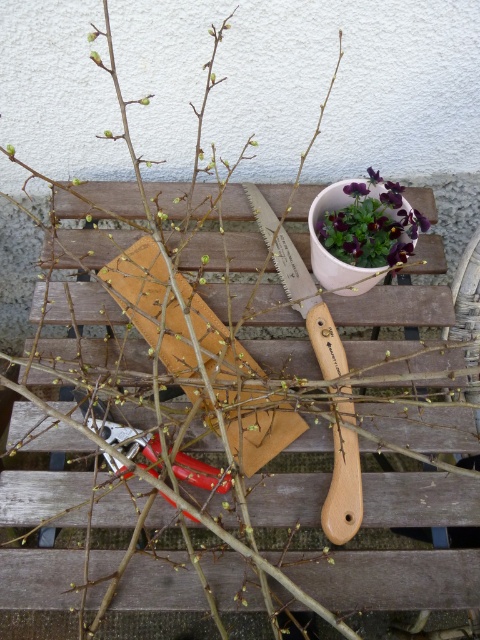
Is purple matte flower pot at upper center shorter than metallic red pliers at center?

No.

What do you see at coordinates (363, 225) in the screenshot?
I see `purple matte flower pot at upper center` at bounding box center [363, 225].

At what (x,y) coordinates should I click in order to perform the action: click on purple matte flower pot at upper center. Please return your answer as a coordinate pair (x, y). The width and height of the screenshot is (480, 640). Looking at the image, I should click on (363, 225).

Which is above, wooden palette at center or purple matte flower pot at upper center?

Positioned higher is purple matte flower pot at upper center.

Locate an element on the screen. wooden palette at center is located at coordinates (300, 288).

Find the location of a particular element. wooden palette at center is located at coordinates (300, 288).

Can you confirm if wooden palette at center is positioned below metallic red pliers at center?

Actually, wooden palette at center is above metallic red pliers at center.

Who is lower down, wooden palette at center or metallic red pliers at center?

metallic red pliers at center is below.

This screenshot has height=640, width=480. Find the location of `wooden palette at center`. wooden palette at center is located at coordinates pos(300,288).

What are the coordinates of `wooden palette at center` in the screenshot? It's located at (300, 288).